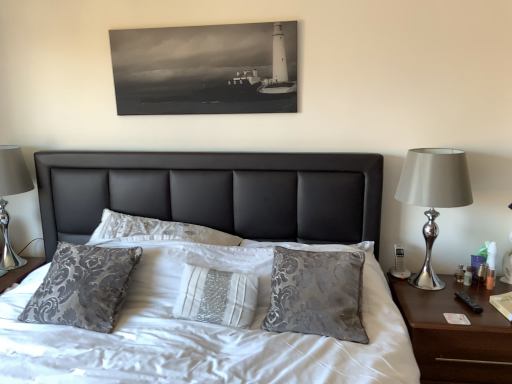
Question: From the image's perspective, would you say brown wood nightstand at right is positioned over silver metallic table lamp at left?

Choices:
 (A) yes
 (B) no

Answer: (B)

Question: From a real-world perspective, does brown wood nightstand at right stand above silver metallic table lamp at left?

Choices:
 (A) yes
 (B) no

Answer: (B)

Question: Is brown wood nightstand at right taller than silver metallic table lamp at left?

Choices:
 (A) no
 (B) yes

Answer: (A)

Question: From the image's perspective, does brown wood nightstand at right appear lower than silver metallic table lamp at left?

Choices:
 (A) no
 (B) yes

Answer: (B)

Question: Considering the relative sizes of brown wood nightstand at right and silver metallic table lamp at left in the image provided, is brown wood nightstand at right bigger than silver metallic table lamp at left?

Choices:
 (A) no
 (B) yes

Answer: (B)

Question: Based on their positions, is brown wood nightstand at right located to the left or right of silver metallic table lamp at left?

Choices:
 (A) right
 (B) left

Answer: (A)

Question: Considering their positions, is brown wood nightstand at right located in front of or behind silver metallic table lamp at left?

Choices:
 (A) behind
 (B) front

Answer: (B)

Question: Based on their sizes in the image, would you say brown wood nightstand at right is bigger or smaller than silver metallic table lamp at left?

Choices:
 (A) big
 (B) small

Answer: (A)

Question: Which is correct: brown wood nightstand at right is inside silver metallic table lamp at left, or outside of it?

Choices:
 (A) outside
 (B) inside

Answer: (A)

Question: From a real-world perspective, relative to silver metallic lamp at right, is brown wood nightstand at right vertically above or below?

Choices:
 (A) below
 (B) above

Answer: (A)

Question: From the image's perspective, is brown wood nightstand at right above or below silver metallic lamp at right?

Choices:
 (A) above
 (B) below

Answer: (B)

Question: Is brown wood nightstand at right wider or thinner than silver metallic lamp at right?

Choices:
 (A) thin
 (B) wide

Answer: (B)

Question: Does point (473, 345) appear closer or farther from the camera than point (437, 175)?

Choices:
 (A) farther
 (B) closer

Answer: (B)

Question: Is silver metallic lamp at right wider or thinner than silver metallic table lamp at left?

Choices:
 (A) wide
 (B) thin

Answer: (B)

Question: Would you say silver metallic lamp at right is to the left or to the right of silver metallic table lamp at left in the picture?

Choices:
 (A) right
 (B) left

Answer: (A)